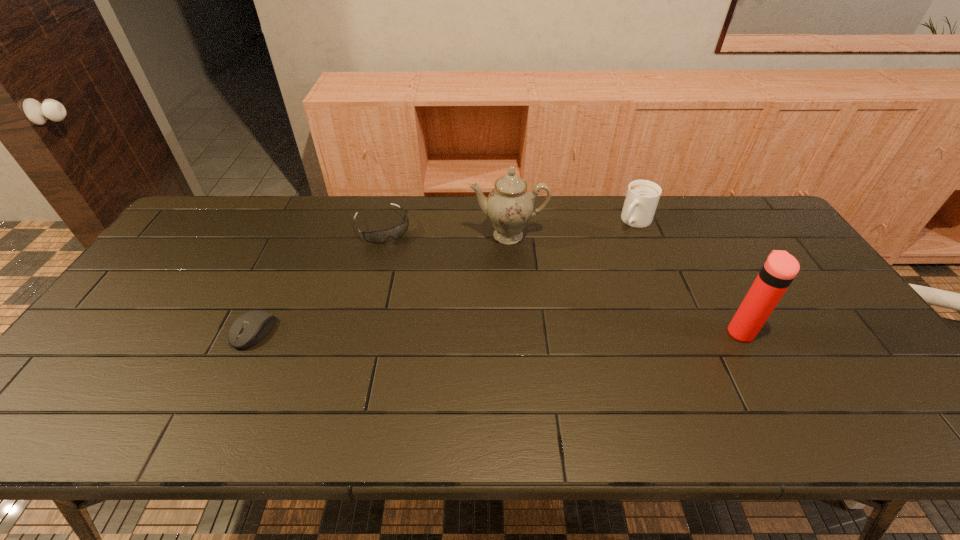
Identify the location of vacant position in the image that satisfies the following two spatial constraints: 1. on the back side of the chinaware; 2. on the left side of the third shortest object. Image resolution: width=960 pixels, height=540 pixels. (507, 221).

I want to click on vacant space that satisfies the following two spatial constraints: 1. on the back side of the third object from right to left; 2. on the left side of the shortest object, so click(300, 235).

Where is `free space that satisfies the following two spatial constraints: 1. on the front side of the thermos bottle; 2. on the left side of the chinaware`? free space that satisfies the following two spatial constraints: 1. on the front side of the thermos bottle; 2. on the left side of the chinaware is located at coordinates (515, 332).